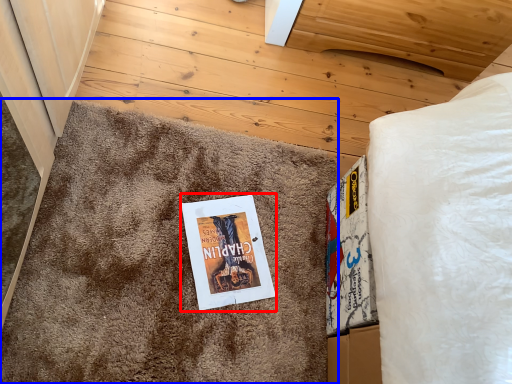
Question: Which object is closer to the camera taking this photo, fiction book (highlighted by a red box) or doormat (highlighted by a blue box)?

Choices:
 (A) fiction book
 (B) doormat

Answer: (B)